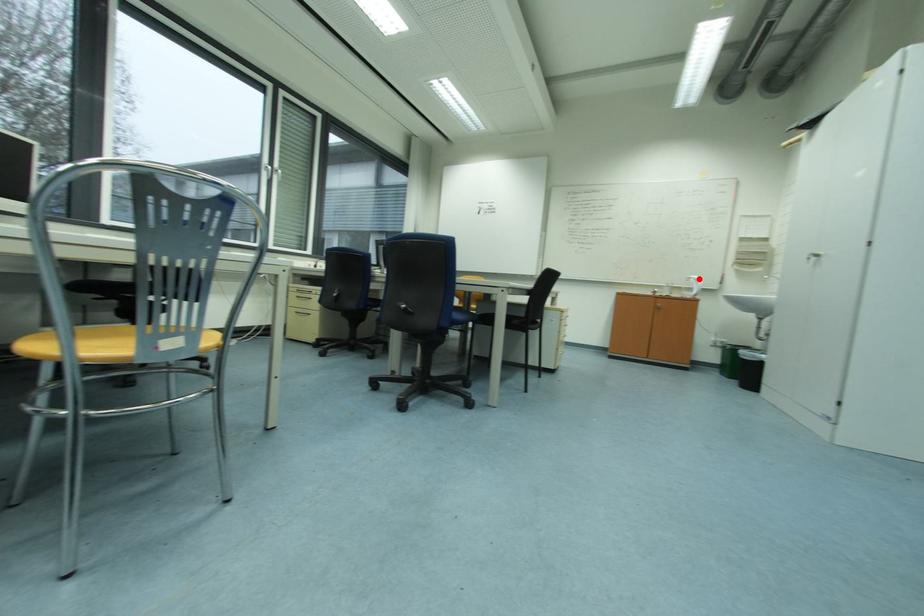
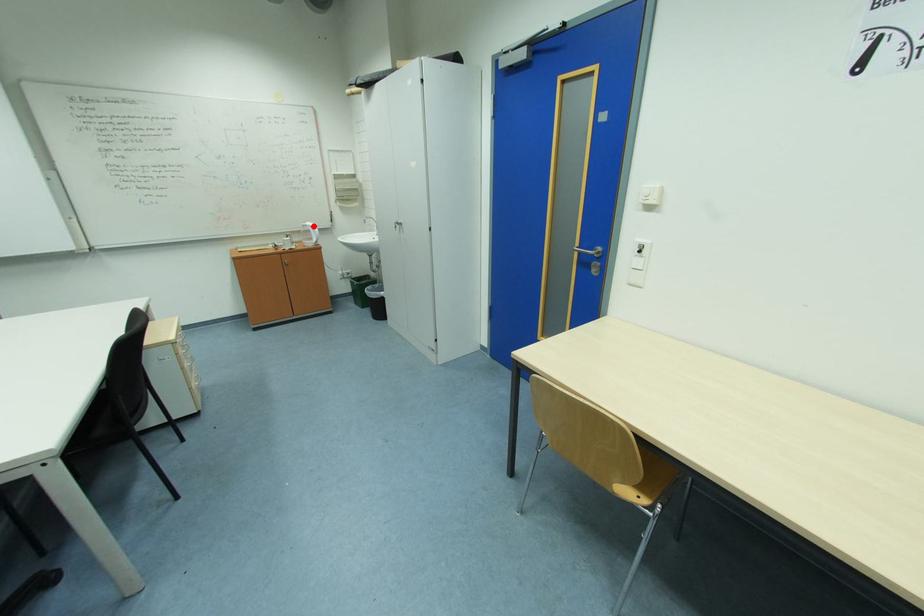
I am providing you with two images of the same scene from different viewpoints. A red point is marked on the first image and another point is marked on the second image. Is the marked point in image1 the same physical position as the marked point in image2?

Yes